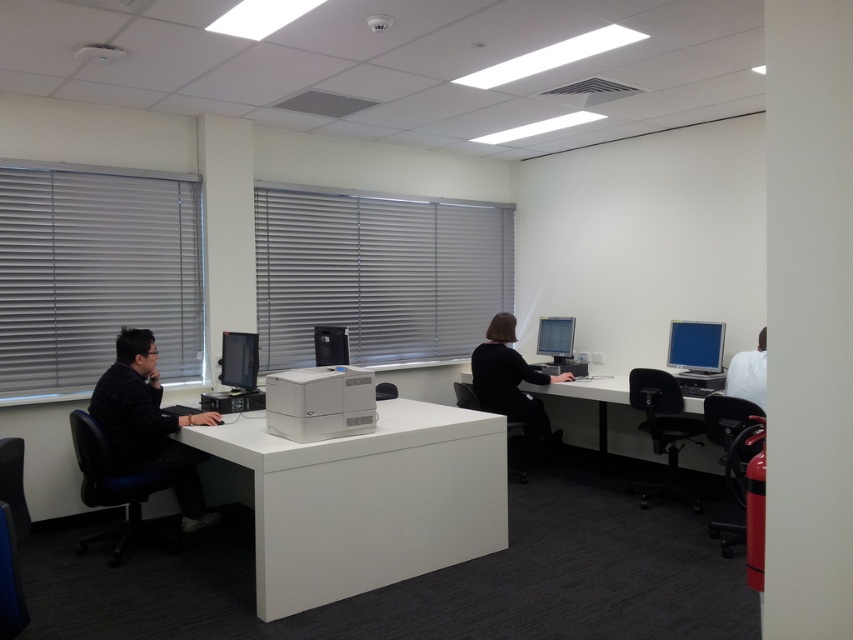
Question: Does black matte computer at center lie in front of matte black monitor at center?

Choices:
 (A) yes
 (B) no

Answer: (A)

Question: Does black fabric swivel chair at left have a smaller size compared to matte black monitor at center?

Choices:
 (A) no
 (B) yes

Answer: (A)

Question: Which object is the farthest from the black fabric swivel chair at left?

Choices:
 (A) black leather swivel chair at right
 (B) black matte computer at center
 (C) white fabric at right

Answer: (C)

Question: Among these objects, which one is nearest to the camera?

Choices:
 (A) white glossy table at center
 (B) black fabric swivel chair at left
 (C) matte black monitor at center
 (D) red leather swivel chair at lower right

Answer: (A)

Question: Which point appears closest to the camera in this image?

Choices:
 (A) (718, 364)
 (B) (96, 465)
 (C) (445, 230)

Answer: (B)

Question: Can you confirm if black fabric swivel chair at left is positioned above matte black monitor at right?

Choices:
 (A) no
 (B) yes

Answer: (A)